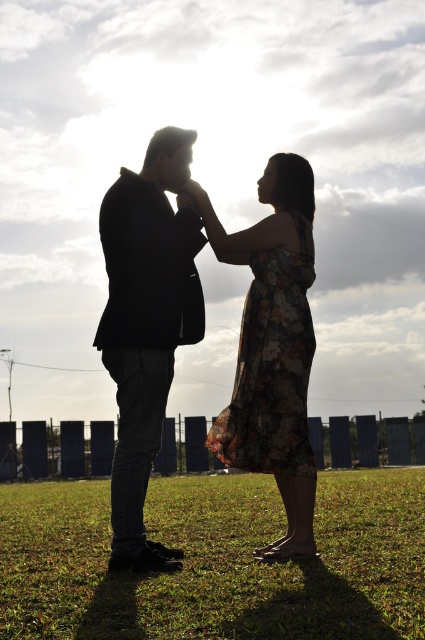
You are a photographer trying to capture the two people in the scene. You want to ensure the green grass at center and the black matte suit at center are both visible in your shot. Based on their positions, which object should you focus on first to ensure both are in frame?

Since the green grass at center is to the right of the black matte suit at center, you should focus on the black matte suit at center first to ensure both are in frame.